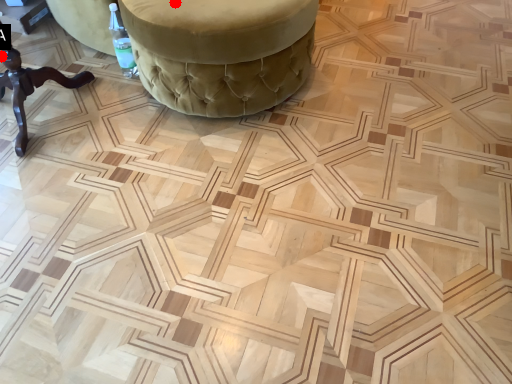
Question: Two points are circled on the image, labeled by A and B beside each circle. Which point appears closest to the camera in this image?

Choices:
 (A) A is closer
 (B) B is closer

Answer: (B)